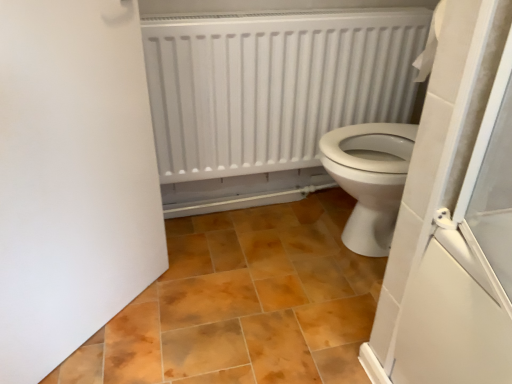
Question: Looking at the image, does white matte radiator at upper center seem bigger or smaller compared to white matte door at left?

Choices:
 (A) small
 (B) big

Answer: (B)

Question: Based on their positions, is white matte radiator at upper center located to the left or right of white matte door at left?

Choices:
 (A) right
 (B) left

Answer: (A)

Question: Based on their relative distances, which object is nearer to the brown matte tile at center?

Choices:
 (A) white matte radiator at upper center
 (B) white matte door at left

Answer: (B)

Question: Which object is the closest to the white matte radiator at upper center?

Choices:
 (A) white matte door at left
 (B) brown matte tile at center

Answer: (B)